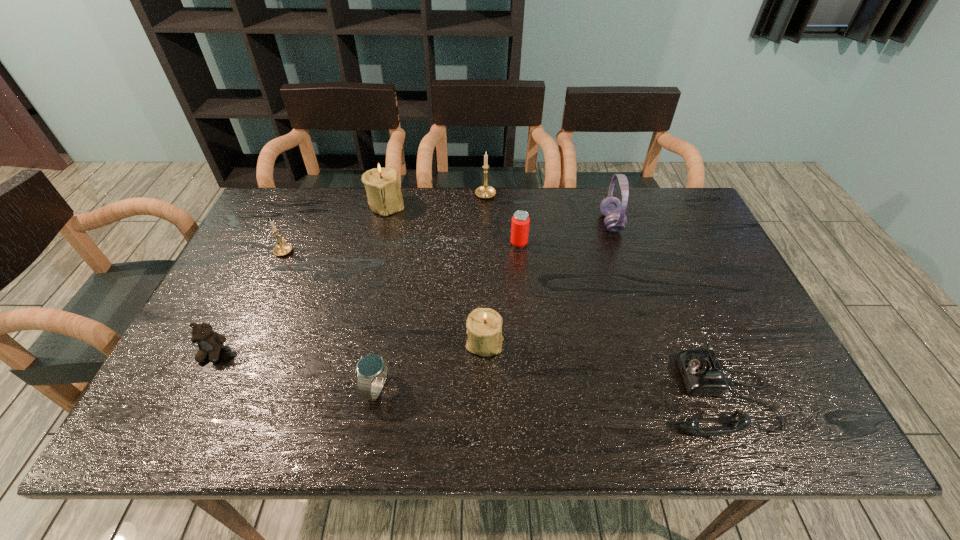
What are the coordinates of `free point at the far left corner` in the screenshot? It's located at (303, 210).

I want to click on vacant space at the far right corner of the desktop, so click(658, 213).

The image size is (960, 540). I want to click on unoccupied area between the nearest candle_holder and the headset, so click(x=548, y=282).

The image size is (960, 540). I want to click on unoccupied position between the farther gold candle holder and the telephone, so tap(601, 295).

Identify the location of free space between the right beige candle_holder and the teddy bear. Image resolution: width=960 pixels, height=540 pixels. (348, 347).

Where is `unoccupied position between the blue watch and the telephone`? The height and width of the screenshot is (540, 960). unoccupied position between the blue watch and the telephone is located at coordinates (546, 390).

Where is `vacant point located between the nearest candle_holder and the second candle_holder from left to right`? vacant point located between the nearest candle_holder and the second candle_holder from left to right is located at coordinates (436, 273).

Where is `vacant region between the third candle_holder from right to left and the third farthest candle_holder`? The image size is (960, 540). vacant region between the third candle_holder from right to left and the third farthest candle_holder is located at coordinates (336, 227).

In order to click on free space that is in between the telephone and the teddy bear in this screenshot , I will do `click(465, 373)`.

You are a GUI agent. You are given a task and a screenshot of the screen. Output one action in this format:
    pyautogui.click(x=<x>, y=<y>)
    Task: Click on the vacant space in between the telephone and the right gold candle holder
    
    Given the screenshot: What is the action you would take?
    pyautogui.click(x=601, y=295)